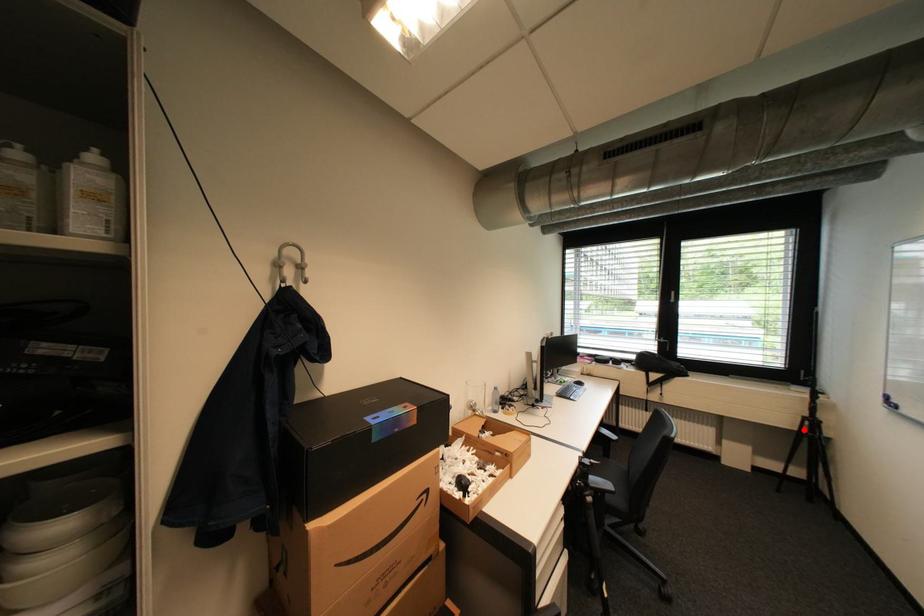
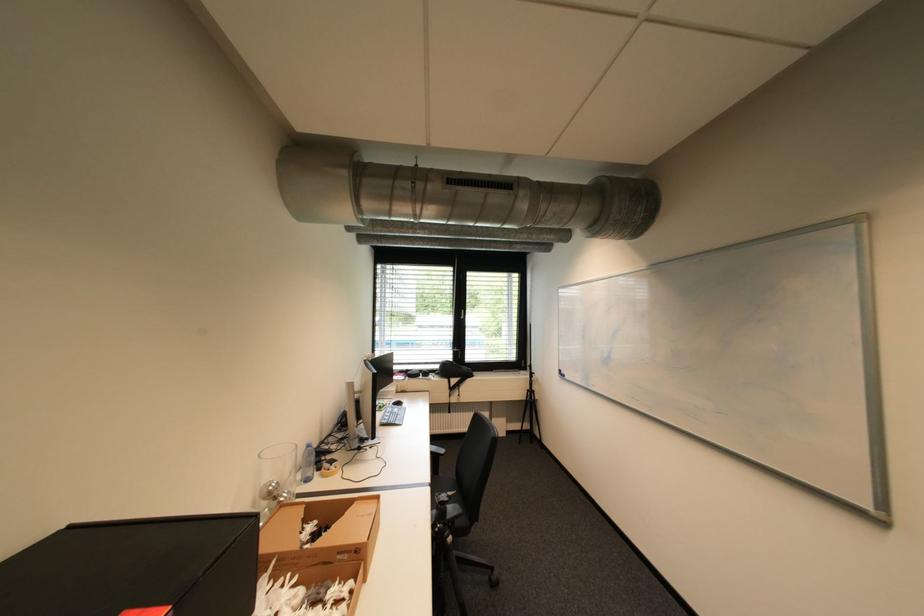
Question: I am providing you with two images of the same scene from different viewpoints. In image1, a red point is highlighted. Considering the same 3D point in image2, which of the following is correct?

Choices:
 (A) It is closer
 (B) It is farther

Answer: (B)